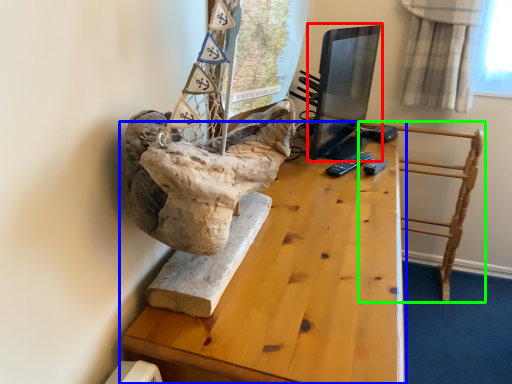
Question: Estimate the real-world distances between objects in this image. Which object is closer to computer monitor (highlighted by a red box), table (highlighted by a blue box) or furniture (highlighted by a green box)?

Choices:
 (A) table
 (B) furniture

Answer: (B)